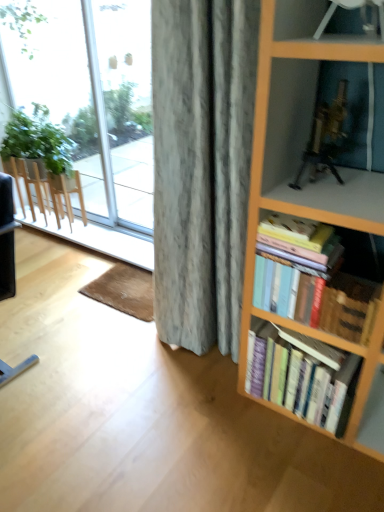
Locate an element on the screen. The image size is (384, 512). free point below black leather chair at lower left (from a real-world perspective) is located at coordinates (14, 345).